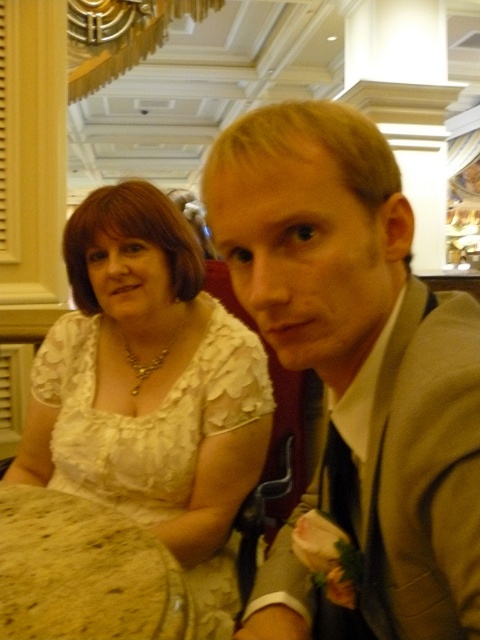
Question: Estimate the real-world distances between objects in this image. Which object is farther from the white lace dress at left?

Choices:
 (A) brown speckled stone table at lower left
 (B) satin beige suit at right

Answer: (B)

Question: Is satin beige suit at right further to the viewer compared to white lace dress at left?

Choices:
 (A) yes
 (B) no

Answer: (B)

Question: Does satin beige suit at right appear over white lace dress at left?

Choices:
 (A) no
 (B) yes

Answer: (B)

Question: Which point is farther from the camera taking this photo?

Choices:
 (A) (139, 636)
 (B) (69, 337)
 (C) (266, 108)

Answer: (B)

Question: Can you confirm if satin beige suit at right is positioned below brown speckled stone table at lower left?

Choices:
 (A) yes
 (B) no

Answer: (B)

Question: Among these points, which one is farthest from the camera?

Choices:
 (A) (32, 570)
 (B) (347, 429)

Answer: (A)